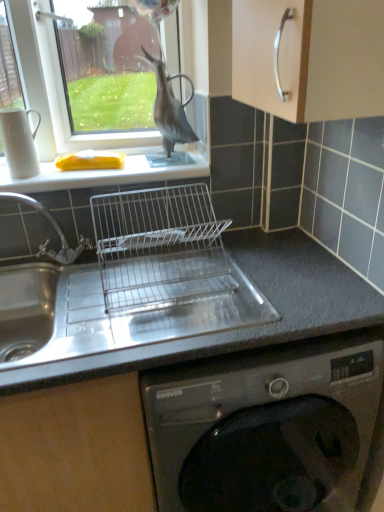
Locate an element on the screen. The image size is (384, 512). clear glass window at upper left is located at coordinates (58, 86).

Measure the distance between point (6, 190) and camera.

1.24 meters.

The width and height of the screenshot is (384, 512). I want to click on stainless steel sink at center, so click(x=117, y=310).

The image size is (384, 512). Identify the location of animal lying above the white matte sponge at upper left (from the image's perspective). (169, 106).

Is matte black bird at upper center inside or outside of white matte sponge at upper left?

The correct answer is: outside.

Is matte black bird at upper center placed right next to white matte sponge at upper left?

No, matte black bird at upper center is not touching white matte sponge at upper left.

Considering the relative positions of matte black bird at upper center and white matte sponge at upper left in the image provided, is matte black bird at upper center to the right of white matte sponge at upper left from the viewer's perspective?

Indeed, matte black bird at upper center is positioned on the right side of white matte sponge at upper left.

From a real-world perspective, is clear glass window at upper left positioned under smooth gray countertop at center based on gravity?

No.

How distant is clear glass window at upper left from smooth gray countertop at center?

clear glass window at upper left is 72.07 centimeters from smooth gray countertop at center.

Are clear glass window at upper left and smooth gray countertop at center beside each other?

No.

Which is in front, point (97, 137) or point (328, 286)?

The point (328, 286) is more forward.

Is point (19, 330) farther from viewer compared to point (184, 76)?

No, it is not.

Which of these two, stainless steel sink at center or matte black bird at upper center, stands taller?

stainless steel sink at center.

Is matte black bird at upper center at the back of stainless steel sink at center?

That's not correct — stainless steel sink at center is not looking away from matte black bird at upper center.

How distant is stainless steel sink at center from matte black bird at upper center?

The distance of stainless steel sink at center from matte black bird at upper center is 21.27 inches.

Is the position of matte black bird at upper center less distant than that of smooth gray countertop at center?

No, it is not.

From their relative heights in the image, would you say matte black bird at upper center is taller or shorter than smooth gray countertop at center?

Considering their sizes, matte black bird at upper center has less height than smooth gray countertop at center.

Which point is more distant from viewer, (193, 140) or (116, 450)?

Point (193, 140)

Is matte black bird at upper center touching smooth gray countertop at center?

No, matte black bird at upper center is not with smooth gray countertop at center.

How distant is matte black bird at upper center from stainless steel sink at center?

matte black bird at upper center and stainless steel sink at center are 21.27 inches apart from each other.

Can you confirm if matte black bird at upper center is wider than stainless steel sink at center?

No.

Does matte black bird at upper center turn towards stainless steel sink at center?

No, matte black bird at upper center does not turn towards stainless steel sink at center.

Between matte black bird at upper center and stainless steel sink at center, which one appears on the left side from the viewer's perspective?

From the viewer's perspective, stainless steel sink at center appears more on the left side.

Does stainless steel sink at center appear on the right side of white matte sponge at upper left?

Indeed, stainless steel sink at center is positioned on the right side of white matte sponge at upper left.

Can you confirm if stainless steel sink at center is bigger than white matte sponge at upper left?

Yes.

Between stainless steel sink at center and white matte sponge at upper left, which one has smaller width?

white matte sponge at upper left is thinner.

From the image's perspective, is stainless steel sink at center under white matte sponge at upper left?

Correct, stainless steel sink at center appears lower than white matte sponge at upper left in the image.

Measure the distance between stainless steel sink at center and smooth gray countertop at center.

The distance of stainless steel sink at center from smooth gray countertop at center is 8.32 inches.

Which is nearer, (24, 310) or (23, 445)?

The point (23, 445) is more forward.

Would you say stainless steel sink at center contains smooth gray countertop at center?

No, stainless steel sink at center does not contain smooth gray countertop at center.

From a real-world perspective, which is physically below, stainless steel sink at center or smooth gray countertop at center?

smooth gray countertop at center, from a real-world perspective.

Locate an element on the screen. animal that is on the right side of white matte sponge at upper left is located at coordinates (169, 106).

Find the location of a particular element. This screenshot has width=384, height=512. window on the left of the smooth gray countertop at center is located at coordinates (58, 86).

When comparing their distances from stainless steel sink at center, does white matte sponge at upper left or matte black bird at upper center seem closer?

white matte sponge at upper left lies closer to stainless steel sink at center than the other object.

Which object lies nearer to the anchor point smooth gray countertop at center, stainless steel sink at center or white matte sponge at upper left?

Based on the image, stainless steel sink at center appears to be nearer to smooth gray countertop at center.

Which object lies nearer to the anchor point white matte sponge at upper left, smooth gray countertop at center or matte black bird at upper center?

matte black bird at upper center.

Based on their spatial positions, is white matte sponge at upper left or clear glass window at upper left further from matte black bird at upper center?

white matte sponge at upper left.

When comparing their distances from white matte sponge at upper left, does stainless steel sink at center or matte black bird at upper center seem closer?

matte black bird at upper center.

Estimate the real-world distances between objects in this image. Which object is further from smooth gray countertop at center, clear glass window at upper left or stainless steel sink at center?

clear glass window at upper left is positioned further to the anchor smooth gray countertop at center.

Based on their spatial positions, is smooth gray countertop at center or matte black bird at upper center further from clear glass window at upper left?

smooth gray countertop at center lies further to clear glass window at upper left than the other object.

Which object lies nearer to the anchor point smooth gray countertop at center, matte black bird at upper center or white matte sponge at upper left?

white matte sponge at upper left is positioned closer to the anchor smooth gray countertop at center.

The image size is (384, 512). In order to click on animal that lies between clear glass window at upper left and stainless steel sink at center from top to bottom in this screenshot , I will do `click(169, 106)`.

The width and height of the screenshot is (384, 512). Find the location of `window sill between matte black bird at upper center and smooth gray countertop at center vertically`. window sill between matte black bird at upper center and smooth gray countertop at center vertically is located at coordinates (111, 172).

Identify the location of sink between clear glass window at upper left and smooth gray countertop at center in the up-down direction. (117, 310).

Image resolution: width=384 pixels, height=512 pixels. Find the location of `sink that lies between white matte sponge at upper left and smooth gray countertop at center from top to bottom`. sink that lies between white matte sponge at upper left and smooth gray countertop at center from top to bottom is located at coordinates (117, 310).